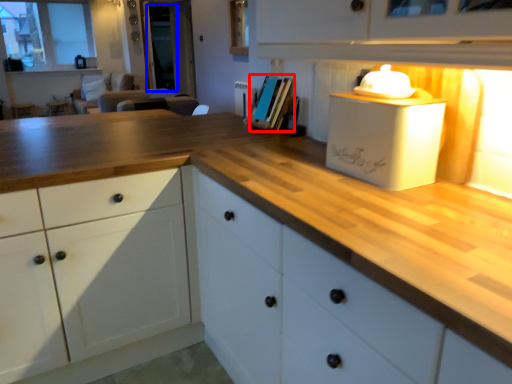
Question: Which object is closer to the camera taking this photo, book (highlighted by a red box) or glass door (highlighted by a blue box)?

Choices:
 (A) book
 (B) glass door

Answer: (A)